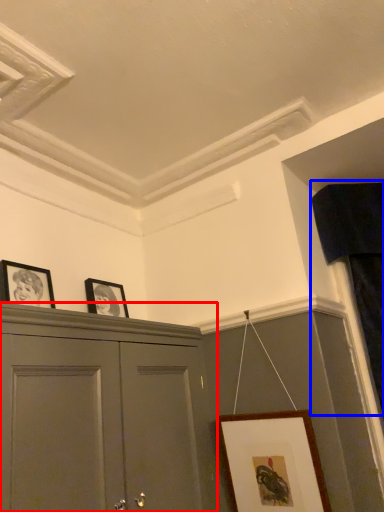
Question: Among these objects, which one is nearest to the camera, cabinetry (highlighted by a red box) or curtain (highlighted by a blue box)?

Choices:
 (A) cabinetry
 (B) curtain

Answer: (A)